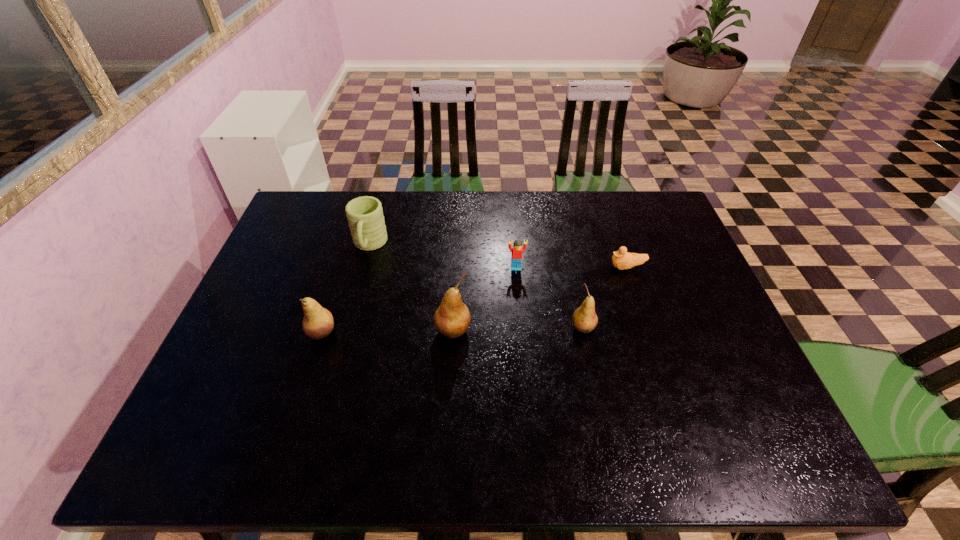
This screenshot has width=960, height=540. Find the location of `free space at the far edge`. free space at the far edge is located at coordinates (543, 217).

You are a GUI agent. You are given a task and a screenshot of the screen. Output one action in this format:
    pyautogui.click(x=<x>, y=<y>)
    Task: Click on the blank space at the near edge of the desktop
    
    Given the screenshot: What is the action you would take?
    pyautogui.click(x=396, y=404)

Where is `free space at the left edge of the desktop`? The width and height of the screenshot is (960, 540). free space at the left edge of the desktop is located at coordinates (252, 294).

Identify the location of vacant space at the right edge of the desktop. (691, 274).

I want to click on free spot at the far left corner of the desktop, so click(308, 212).

Identify the location of free region at the far right corner of the desktop. (629, 196).

At what (x,y) coordinates should I click in order to perform the action: click on free space between the second pear from right to left and the mug. Please return your answer as a coordinate pair (x, y). This screenshot has height=540, width=960. Looking at the image, I should click on (411, 288).

Locate an element on the screen. vacant area between the shortest object and the mug is located at coordinates (498, 256).

Locate an element on the screen. vacant space that is in between the rightmost object and the mug is located at coordinates (498, 256).

Locate an element on the screen. The height and width of the screenshot is (540, 960). empty space that is in between the second object from right to left and the rightmost object is located at coordinates (605, 298).